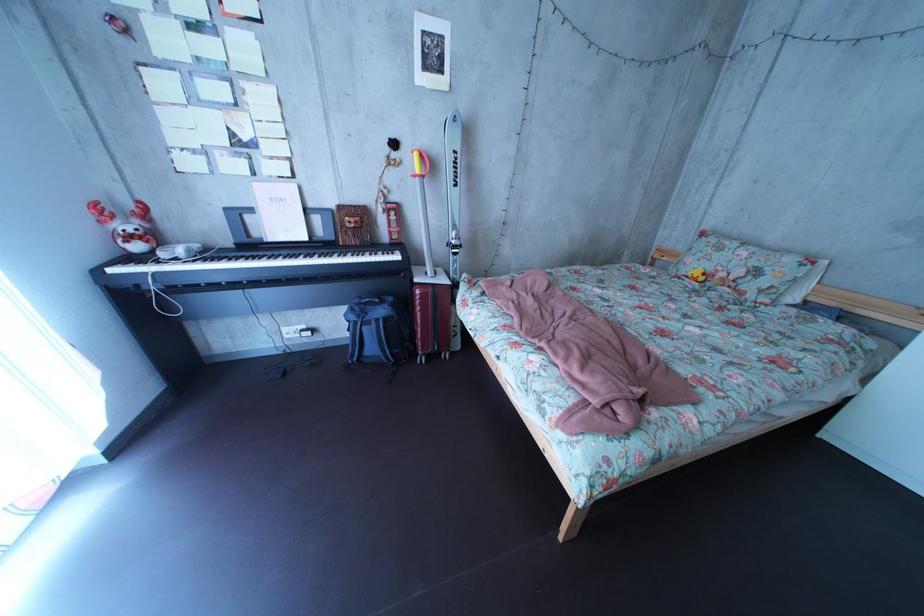
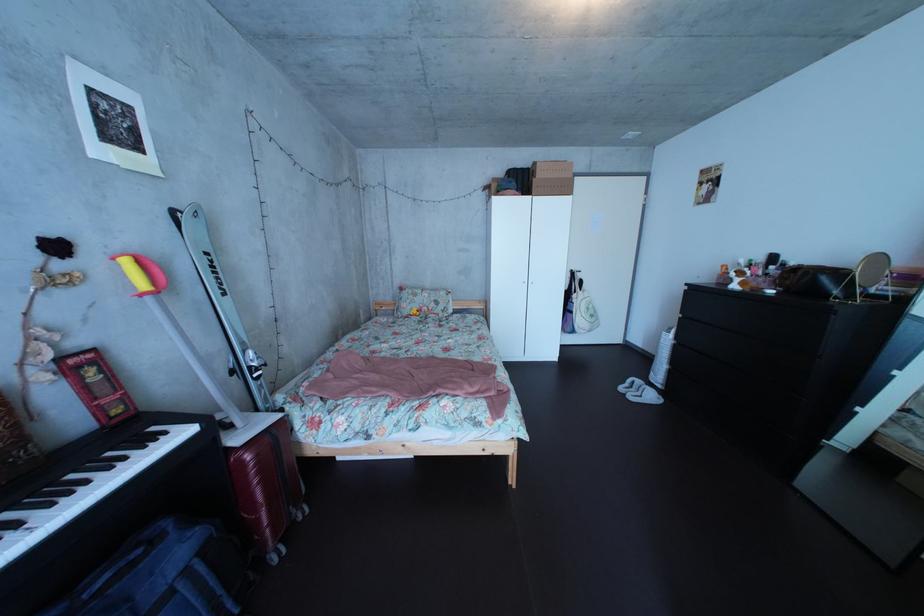
Question: How did the camera likely rotate?

Choices:
 (A) Left
 (B) Right
 (C) Up
 (D) Down

Answer: (B)